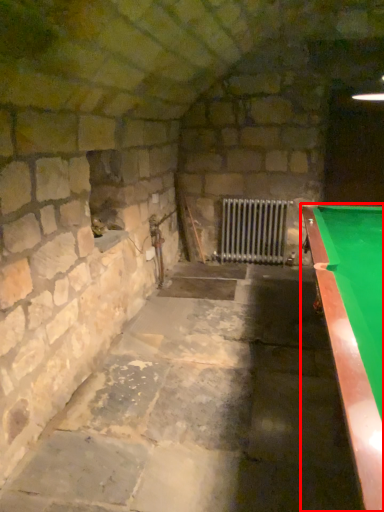
Question: Where is billiard table (annotated by the red box) located in relation to radiator in the image?

Choices:
 (A) left
 (B) right

Answer: (B)